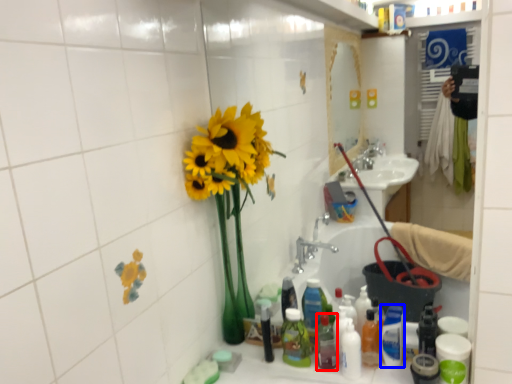
Question: Which point is further to the camera, bottle (highlighted by a red box) or cleaning product (highlighted by a blue box)?

Choices:
 (A) bottle
 (B) cleaning product

Answer: (A)